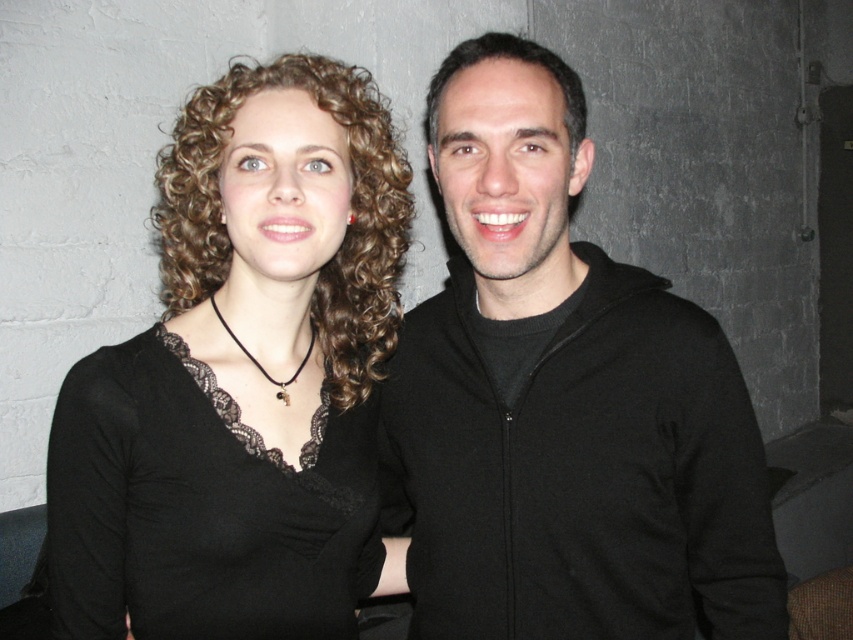
Question: Is black lace top at center smaller than black lace dress at left?

Choices:
 (A) yes
 (B) no

Answer: (B)

Question: Does black zip-up hoodie at right appear over black lace dress at left?

Choices:
 (A) yes
 (B) no

Answer: (A)

Question: Which point is farther to the camera?

Choices:
 (A) (279, 212)
 (B) (535, 141)
 (C) (158, 477)

Answer: (B)

Question: Does black lace top at center appear over black lace dress at left?

Choices:
 (A) no
 (B) yes

Answer: (B)

Question: Which of the following is the farthest from the observer?

Choices:
 (A) (770, 579)
 (B) (200, 456)

Answer: (A)

Question: Which of the following is the closest to the observer?

Choices:
 (A) (599, 352)
 (B) (178, 525)
 (C) (317, 321)

Answer: (B)